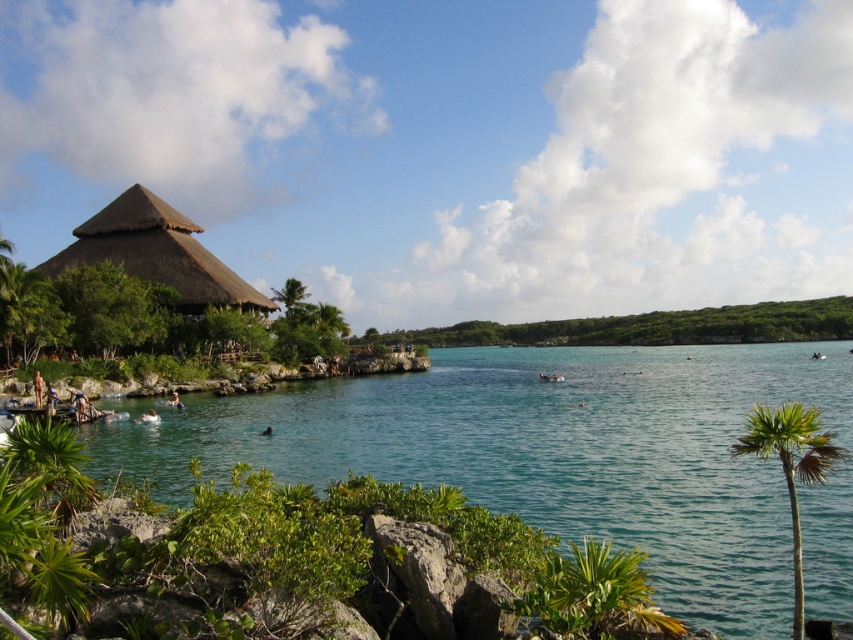
Which is behind, point (427, 342) or point (97, 240)?

Point (427, 342)

Does green leafy vegetation at center have a lesser height compared to brown thatch hut at left?

Incorrect, green leafy vegetation at center's height does not fall short of brown thatch hut at left's.

Consider the image. Who is more distant from viewer, (547, 344) or (131, 259)?

Point (547, 344)

You are a GUI agent. You are given a task and a screenshot of the screen. Output one action in this format:
    pyautogui.click(x=<x>, y=<y>)
    Task: Click on the green leafy vegetation at center
    The width and height of the screenshot is (853, 640).
    Given the screenshot: What is the action you would take?
    pyautogui.click(x=654, y=326)

Does clear blue water at center appear over green leafy palm tree at lower right?

Indeed, clear blue water at center is positioned over green leafy palm tree at lower right.

Is clear blue water at center to the left of green leafy palm tree at lower right from the viewer's perspective?

No, clear blue water at center is not to the left of green leafy palm tree at lower right.

Does point (810, 582) come farther from viewer compared to point (793, 509)?

Yes, point (810, 582) is behind point (793, 509).

Identify the location of clear blue water at center. tap(561, 458).

Measure the distance between point (724, 572) and camera.

The distance of point (724, 572) from camera is 64.68 feet.

Does clear blue water at center have a greater width compared to brown thatch hut at left?

Correct, the width of clear blue water at center exceeds that of brown thatch hut at left.

Is point (842, 422) behind point (190, 248)?

No, (842, 422) is in front of (190, 248).

The image size is (853, 640). I want to click on clear blue water at center, so click(x=561, y=458).